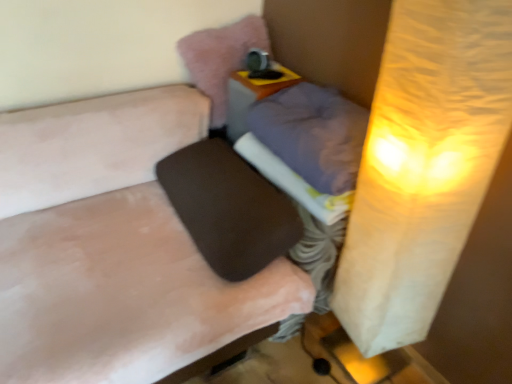
Question: Is white fabric at center taller or shorter than brown matte speaker at center?

Choices:
 (A) short
 (B) tall

Answer: (A)

Question: From a real-world perspective, is white fabric at center above or below brown matte speaker at center?

Choices:
 (A) below
 (B) above

Answer: (B)

Question: Estimate the real-world distances between objects in this image. Which object is farther from the black fabric footrest at center?

Choices:
 (A) brown matte speaker at center
 (B) white paper lampshade at upper right
 (C) purple fabric pillow at center, which is the 2th pillow from top to bottom
 (D) matte plastic table at center
 (E) white fabric at center

Answer: (B)

Question: Which object is positioned closest to the black fabric footrest at center?

Choices:
 (A) white fabric at center
 (B) brown matte speaker at center
 (C) metallic silver table lamp at upper center
 (D) matte plastic table at center
 (E) pink plush pillow at upper center, which is counted as the first pillow, starting from the top

Answer: (A)